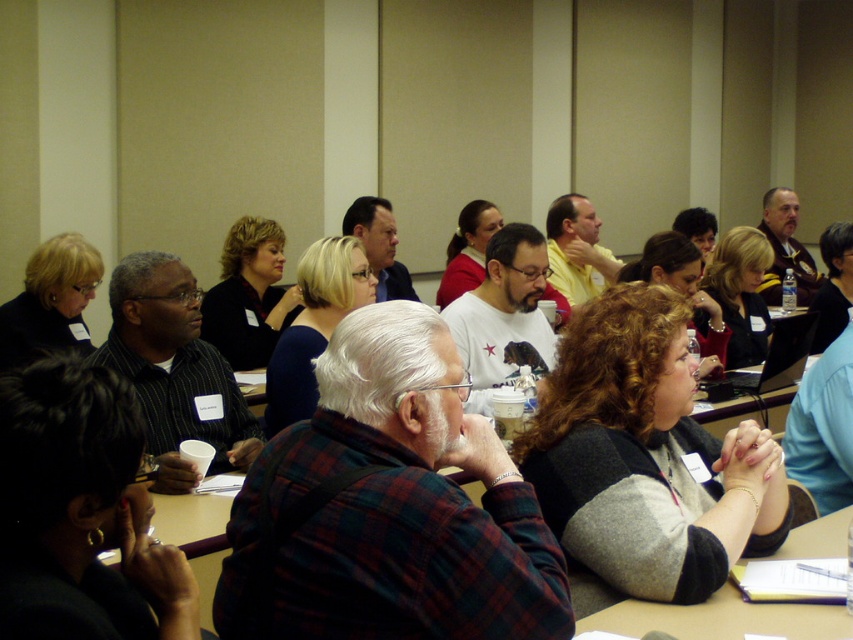
Can you confirm if black sweater at center is positioned below matte black sweater at upper left?

No.

Is point (252, 352) farther from camera compared to point (70, 301)?

Yes, point (252, 352) is farther from viewer.

This screenshot has height=640, width=853. What are the coordinates of `black sweater at center` in the screenshot? It's located at (248, 294).

Describe the element at coordinates (722, 618) in the screenshot. I see `gray fabric at lower right` at that location.

Is gray fabric at lower right above blue fabric shirt at center?

Incorrect, gray fabric at lower right is not positioned above blue fabric shirt at center.

At what (x,y) coordinates should I click in order to perform the action: click on gray fabric at lower right. Please return your answer as a coordinate pair (x, y). The image size is (853, 640). Looking at the image, I should click on (722, 618).

At what (x,y) coordinates should I click in order to perform the action: click on gray fabric at lower right. Please return your answer as a coordinate pair (x, y). Looking at the image, I should click on (722, 618).

Who is shorter, curly hair sweater at center or blue fabric shirt at center?

curly hair sweater at center is shorter.

Does curly hair sweater at center appear over blue fabric shirt at center?

Actually, curly hair sweater at center is below blue fabric shirt at center.

Who is more distant from viewer, (764, 483) or (306, 257)?

Point (306, 257)

What are the coordinates of `curly hair sweater at center` in the screenshot? It's located at (645, 458).